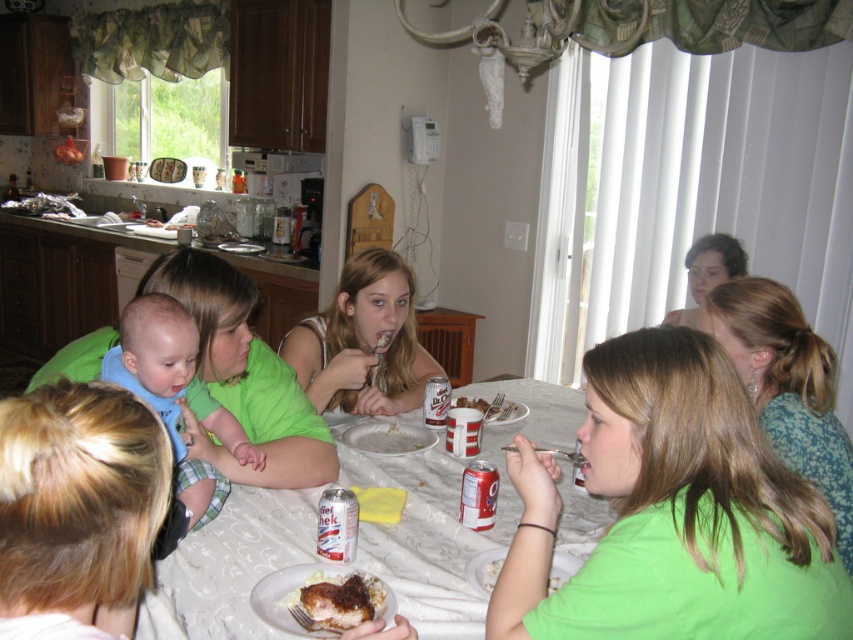
Between matte green shirt at upper right and silver metallic can at lower center, which one is positioned higher?

matte green shirt at upper right is above.

Is point (700, 300) closer to viewer compared to point (492, 513)?

That is False.

You are a GUI agent. You are given a task and a screenshot of the screen. Output one action in this format:
    pyautogui.click(x=<x>, y=<y>)
    Task: Click on the matte green shirt at upper right
    
    Given the screenshot: What is the action you would take?
    pyautogui.click(x=708, y=272)

How distant is white paper plate at lower center from matte green shirt at center?

white paper plate at lower center is 16.40 inches from matte green shirt at center.

From the picture: Who is higher up, white paper plate at lower center or matte green shirt at center?

Positioned higher is matte green shirt at center.

This screenshot has height=640, width=853. What do you see at coordinates (450, 515) in the screenshot?
I see `white paper plate at lower center` at bounding box center [450, 515].

Locate an element on the screen. This screenshot has height=640, width=853. white paper plate at lower center is located at coordinates (450, 515).

Is green matte shirt at lower right further to the viewer compared to diet coke can at center?

No, green matte shirt at lower right is in front of diet coke can at center.

Find the location of a particular element. green matte shirt at lower right is located at coordinates (693, 586).